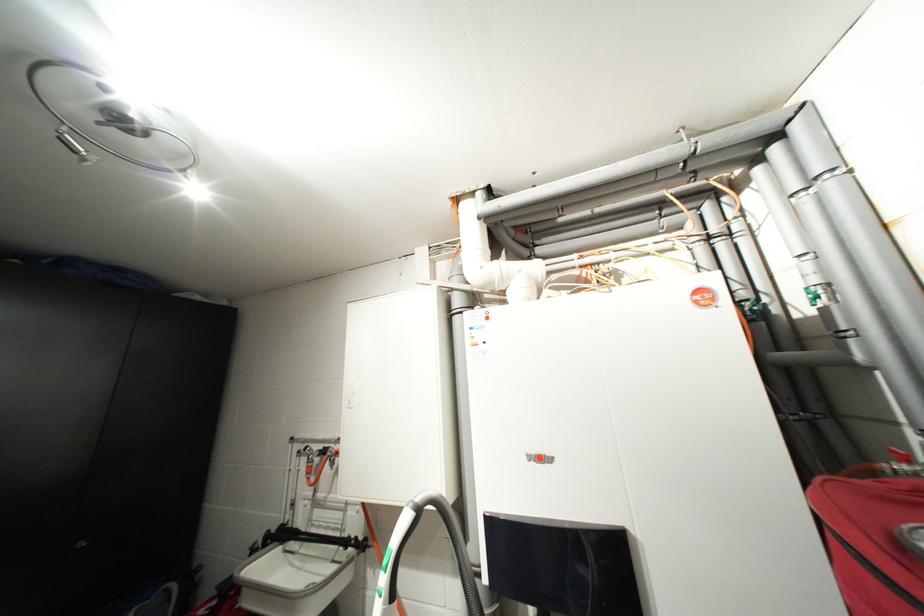
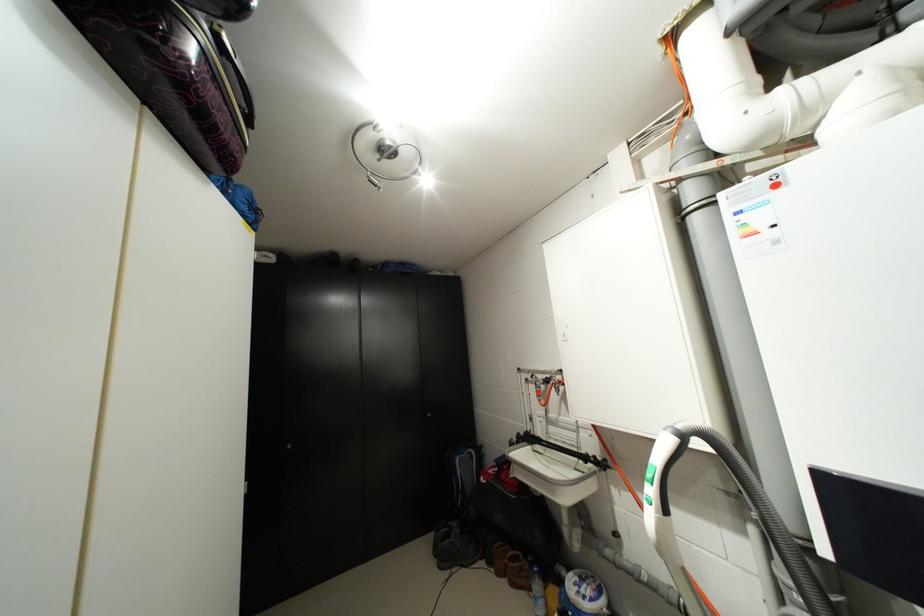
Where in the second image is the point corresponding to point (323, 455) from the first image?

(549, 383)